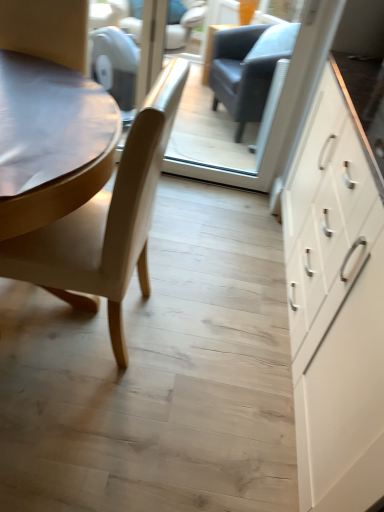
Question: Is light beige leather chair at left behind transparent glass door at center?

Choices:
 (A) yes
 (B) no

Answer: (B)

Question: From a real-world perspective, is light beige leather chair at left located higher than transparent glass door at center?

Choices:
 (A) no
 (B) yes

Answer: (A)

Question: From the image's perspective, does light beige leather chair at left appear higher than transparent glass door at center?

Choices:
 (A) yes
 (B) no

Answer: (B)

Question: Can you confirm if light beige leather chair at left is taller than transparent glass door at center?

Choices:
 (A) yes
 (B) no

Answer: (B)

Question: From a real-world perspective, is light beige leather chair at left below transparent glass door at center?

Choices:
 (A) no
 (B) yes

Answer: (B)

Question: Looking at the image, does transparent glass door at center seem bigger or smaller compared to light beige leather chair at left?

Choices:
 (A) big
 (B) small

Answer: (B)

Question: Considering their positions, is transparent glass door at center located in front of or behind light beige leather chair at left?

Choices:
 (A) behind
 (B) front

Answer: (A)

Question: From a real-world perspective, relative to light beige leather chair at left, is transparent glass door at center vertically above or below?

Choices:
 (A) above
 (B) below

Answer: (A)

Question: Considering the positions of transparent glass door at center and light beige leather chair at left in the image, is transparent glass door at center taller or shorter than light beige leather chair at left?

Choices:
 (A) tall
 (B) short

Answer: (A)

Question: Based on their sizes in the image, would you say white matte cabinet at right is bigger or smaller than transparent glass door at center?

Choices:
 (A) big
 (B) small

Answer: (A)

Question: Is point (309, 310) closer or farther from the camera than point (200, 166)?

Choices:
 (A) farther
 (B) closer

Answer: (B)

Question: Based on their positions, is white matte cabinet at right located to the left or right of transparent glass door at center?

Choices:
 (A) right
 (B) left

Answer: (A)

Question: In terms of width, does white matte cabinet at right look wider or thinner when compared to transparent glass door at center?

Choices:
 (A) thin
 (B) wide

Answer: (B)

Question: Is light beige leather chair at left inside or outside of white matte cabinet at right?

Choices:
 (A) outside
 (B) inside

Answer: (A)

Question: In the image, is light beige leather chair at left positioned in front of or behind white matte cabinet at right?

Choices:
 (A) front
 (B) behind

Answer: (B)